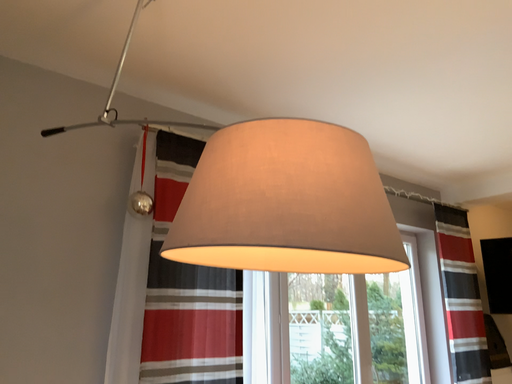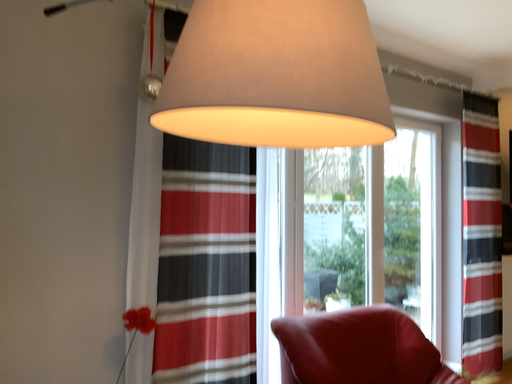
Question: How did the camera likely rotate when shooting the video?

Choices:
 (A) rotated downward
 (B) rotated upward

Answer: (A)